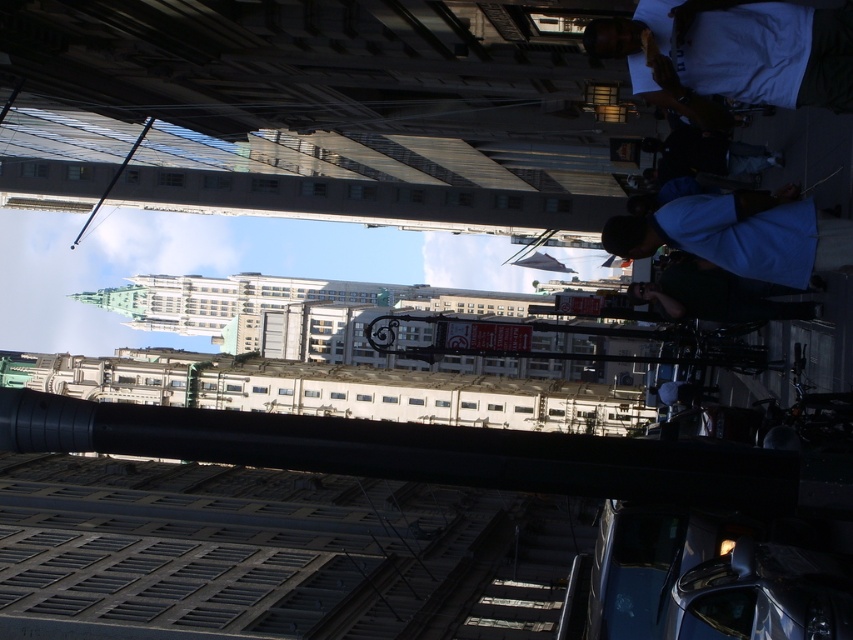
Question: Does metallic gray train track at lower center have a smaller size compared to white cotton shirt at upper right?

Choices:
 (A) no
 (B) yes

Answer: (A)

Question: Can you confirm if metallic gray train track at lower center is bigger than white cotton shirt at upper right?

Choices:
 (A) no
 (B) yes

Answer: (B)

Question: Which point appears farthest from the camera in this image?

Choices:
 (A) (747, 49)
 (B) (360, 636)

Answer: (B)

Question: Is metallic gray train track at lower center below white cotton shirt at upper right?

Choices:
 (A) yes
 (B) no

Answer: (A)